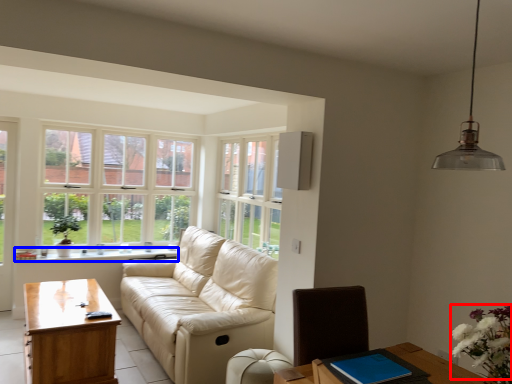
Question: Which object appears closest to the camera in this image, flower (highlighted by a red box) or window sill (highlighted by a blue box)?

Choices:
 (A) flower
 (B) window sill

Answer: (A)